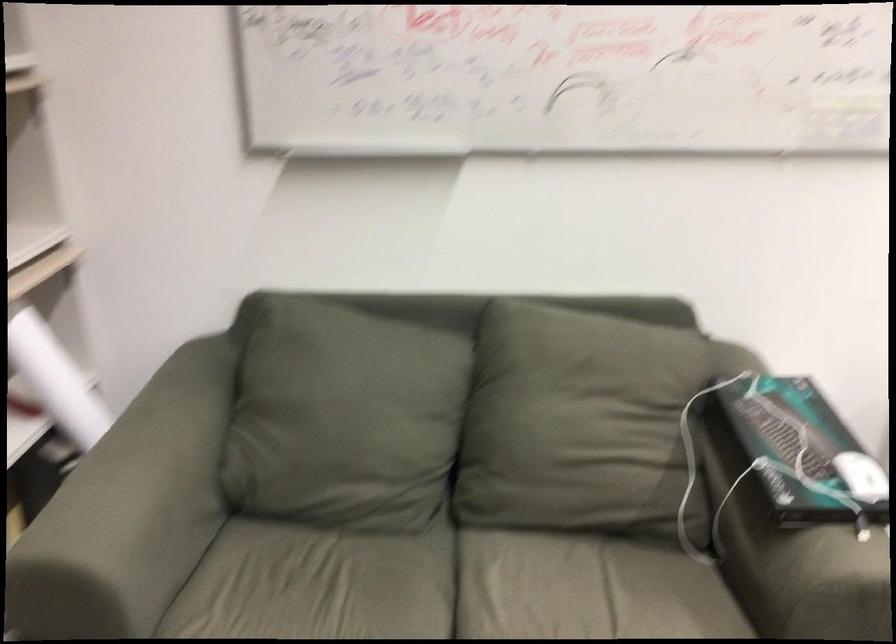
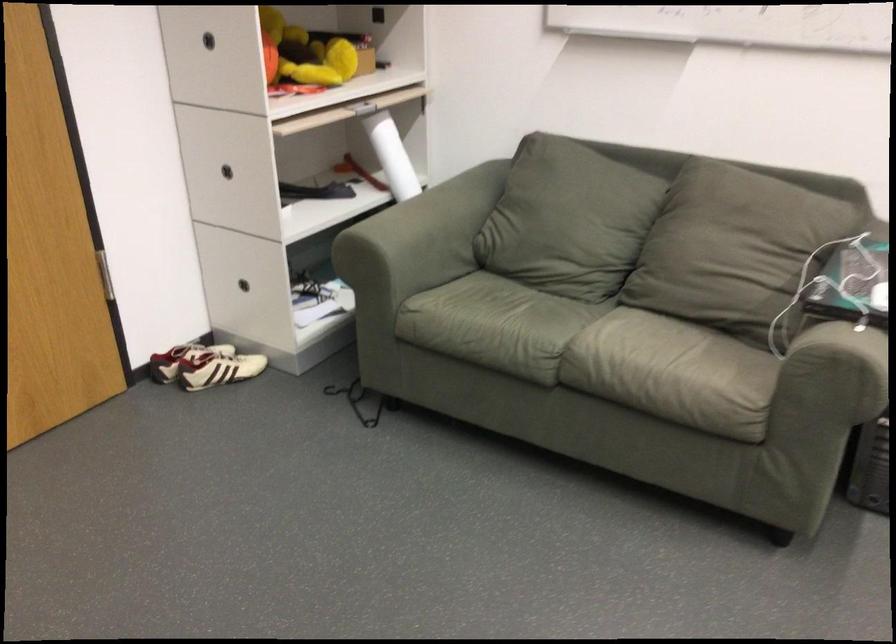
The point at (590, 422) is marked in the first image. Where is the corresponding point in the second image?

(728, 243)